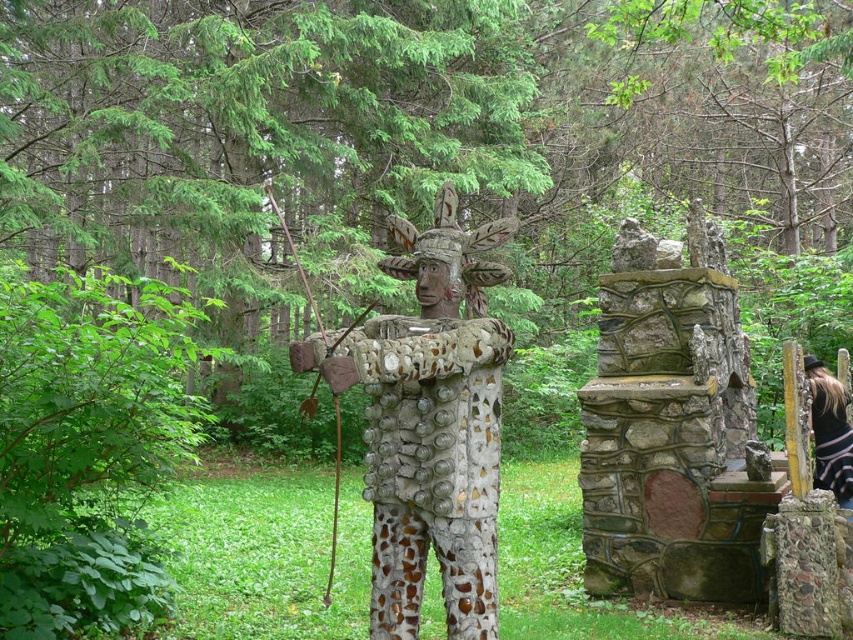
Question: Can you confirm if polished stone statue at center is positioned to the right of black striped dress at lower right?

Choices:
 (A) yes
 (B) no

Answer: (B)

Question: Is polished stone statue at center thinner than black striped dress at lower right?

Choices:
 (A) yes
 (B) no

Answer: (B)

Question: Which point is closer to the camera taking this photo?

Choices:
 (A) (833, 392)
 (B) (456, 260)

Answer: (B)

Question: Is polished stone statue at center to the left of black striped dress at lower right from the viewer's perspective?

Choices:
 (A) yes
 (B) no

Answer: (A)